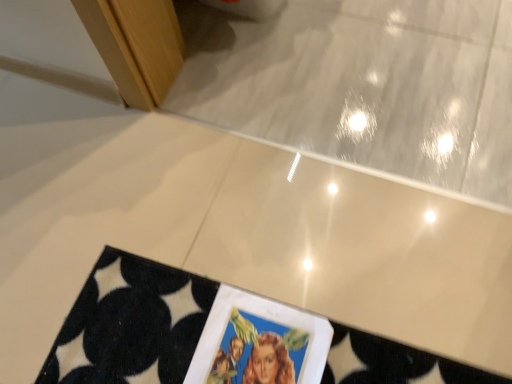
The image size is (512, 384). I want to click on free point behind white glossy tablet at center, so click(226, 257).